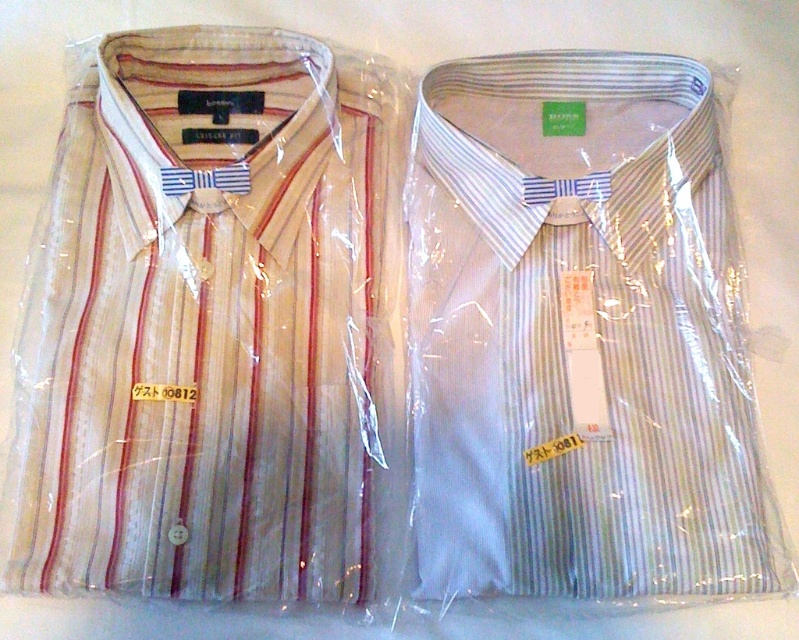
Can you confirm if white striped shirt at left is positioned below light blue striped shirt at center?

Incorrect, white striped shirt at left is not positioned below light blue striped shirt at center.

Which is behind, point (269, 56) or point (456, 516)?

The point (269, 56) is more distant.

Where is `white striped shirt at left`? This screenshot has width=799, height=640. white striped shirt at left is located at coordinates (215, 326).